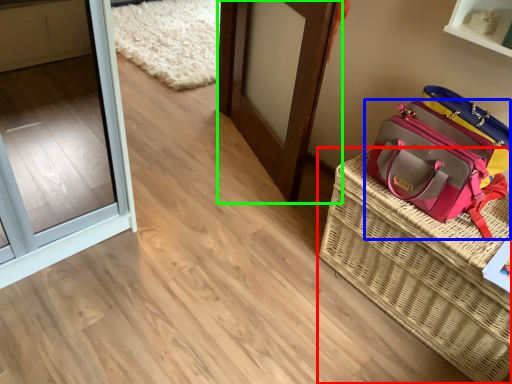
Question: Which is farther away from picnic basket (highlighted by a red box)? handbag (highlighted by a blue box) or door (highlighted by a green box)?

Choices:
 (A) handbag
 (B) door

Answer: (B)